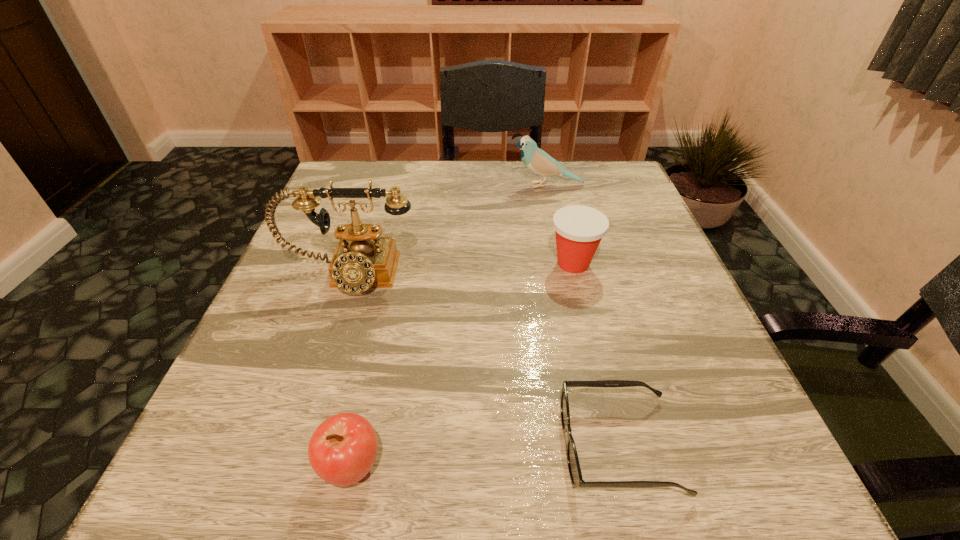
You are a GUI agent. You are given a task and a screenshot of the screen. Output one action in this format:
    pyautogui.click(x=<x>, y=<y>)
    Task: Click on the free space located 0.370m on the front of the Dixie cup
    
    Given the screenshot: What is the action you would take?
    pyautogui.click(x=622, y=465)

Identify the location of vacant space located 0.050m on the right of the apple. (420, 467).

Locate an element on the screen. vacant space located at the front lenses of the shortest object is located at coordinates (529, 446).

Locate an element on the screen. free location located at the front lenses of the shortest object is located at coordinates (307, 446).

Find the location of `blank area located at the front lenses of the shortest object`. blank area located at the front lenses of the shortest object is located at coordinates (300, 446).

Locate an element on the screen. object present at the far edge is located at coordinates (537, 160).

This screenshot has height=540, width=960. Find the location of `apple located at the near edge`. apple located at the near edge is located at coordinates (342, 450).

In order to click on sunglasses present at the near edge in this screenshot , I will do `click(577, 481)`.

You are a GUI agent. You are given a task and a screenshot of the screen. Output one action in this format:
    pyautogui.click(x=<x>, y=<y>)
    Task: Click on the object present at the left edge
    This screenshot has width=960, height=540.
    Given the screenshot: What is the action you would take?
    pyautogui.click(x=362, y=259)

Locate an element on the screen. Image resolution: width=960 pixels, height=540 pixels. bird located in the right edge section of the desktop is located at coordinates (537, 160).